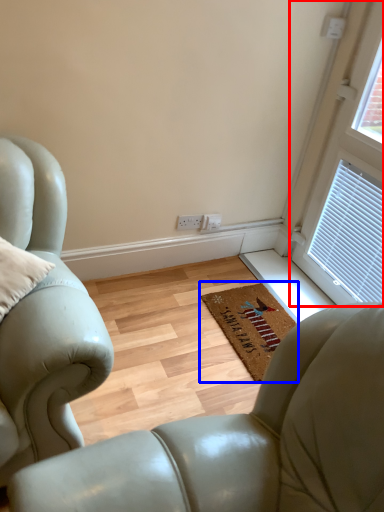
Question: Among these objects, which one is farthest to the camera, window (highlighted by a red box) or mat (highlighted by a blue box)?

Choices:
 (A) window
 (B) mat

Answer: (B)